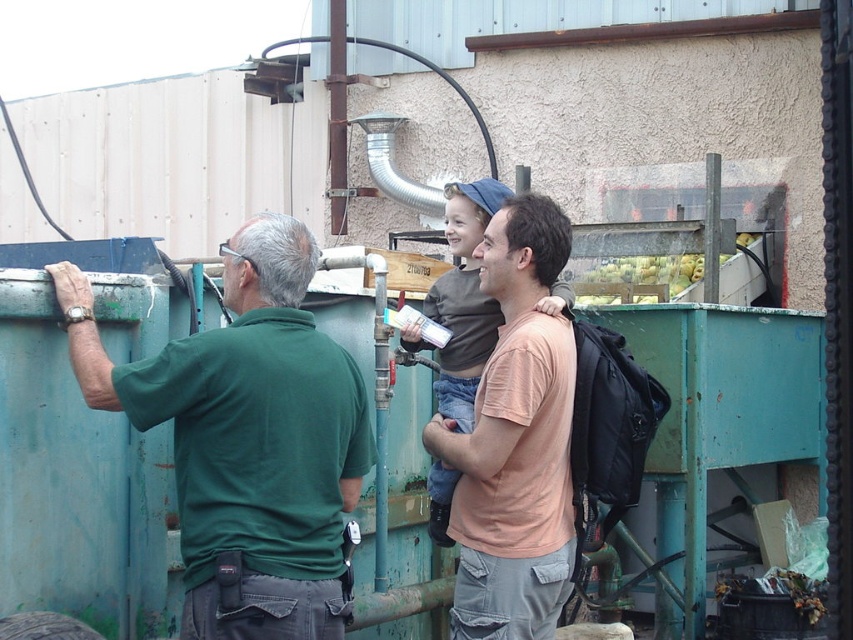
Does green matte shirt at left lie in front of matte peach t-shirt at center?

Yes.

Can you confirm if green matte shirt at left is thinner than matte peach t-shirt at center?

No, green matte shirt at left is not thinner than matte peach t-shirt at center.

Find the location of `green matte shirt at left`. green matte shirt at left is located at coordinates (247, 440).